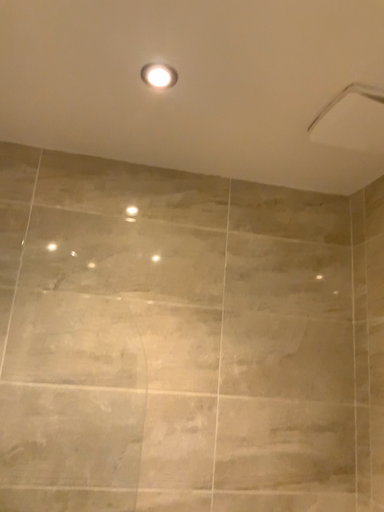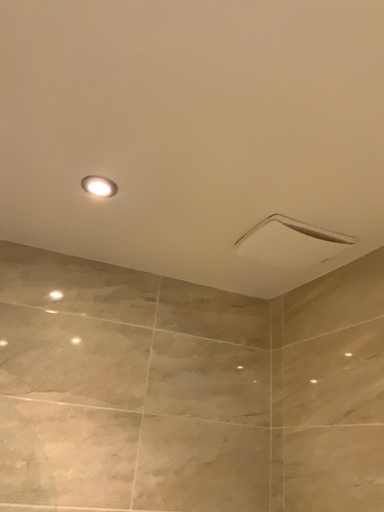
Question: Which way did the camera rotate in the video?

Choices:
 (A) rotated left
 (B) rotated right

Answer: (B)